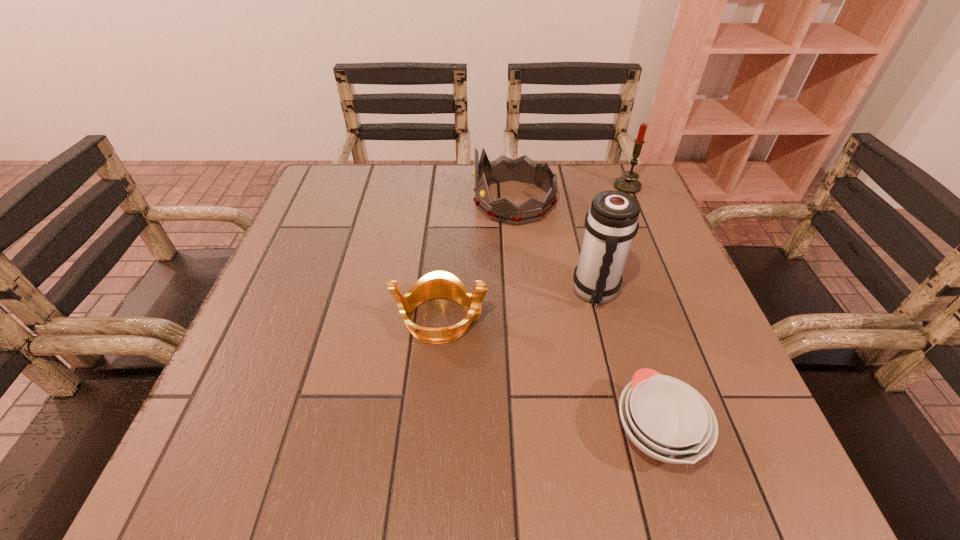
Identify the location of object identified as the fourth closest to the second shortest object. The height and width of the screenshot is (540, 960). click(x=628, y=183).

Find the location of `object that can be found as the third closest to the soup bowl`. object that can be found as the third closest to the soup bowl is located at coordinates (523, 169).

The width and height of the screenshot is (960, 540). Find the location of `free space that satisfies the following two spatial constraints: 1. at the front emblem of the fourth tallest object; 2. on the left side of the nearest object`. free space that satisfies the following two spatial constraints: 1. at the front emblem of the fourth tallest object; 2. on the left side of the nearest object is located at coordinates (432, 431).

This screenshot has width=960, height=540. I want to click on free location that satisfies the following two spatial constraints: 1. on the side with the handle of the thermos bottle; 2. at the front emblem of the nearer tiara, so click(602, 319).

Where is `free spot that satisfies the following two spatial constraints: 1. on the front side of the rightmost object; 2. at the front of the third shortest object with jewels`? The image size is (960, 540). free spot that satisfies the following two spatial constraints: 1. on the front side of the rightmost object; 2. at the front of the third shortest object with jewels is located at coordinates (634, 201).

The image size is (960, 540). I want to click on free location that satisfies the following two spatial constraints: 1. on the side with the handle of the thermos bottle; 2. on the right side of the shortest object, so click(631, 431).

What are the coordinates of `vacant area in the image that satisfies the following two spatial constraints: 1. on the side with the handle of the tallest object; 2. at the front emblem of the shorter tiara` in the screenshot? It's located at (602, 319).